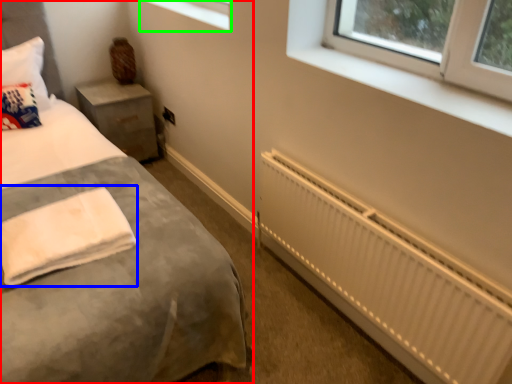
Question: Estimate the real-world distances between objects in this image. Which object is closer to bed (highlighted by a red box), cloth (highlighted by a blue box) or window (highlighted by a green box)?

Choices:
 (A) cloth
 (B) window

Answer: (A)